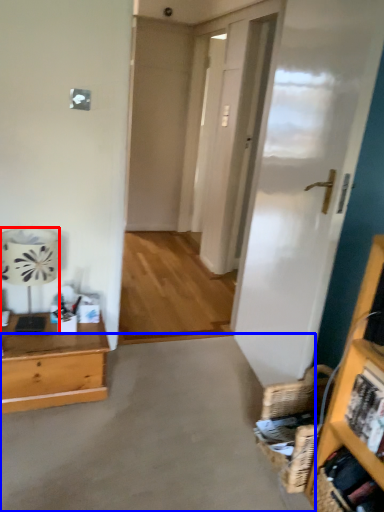
Question: Which object is further to the camera taking this photo, lamp (highlighted by a red box) or concrete (highlighted by a blue box)?

Choices:
 (A) lamp
 (B) concrete

Answer: (A)